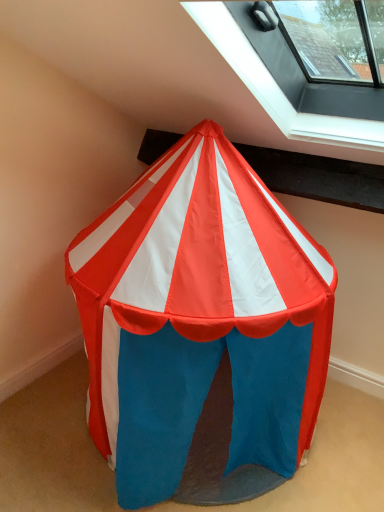
This screenshot has width=384, height=512. Describe the element at coordinates (277, 86) in the screenshot. I see `transparent glass window at upper right` at that location.

At what (x,y) coordinates should I click in order to perform the action: click on transparent glass window at upper right. Please return your answer as a coordinate pair (x, y). Image resolution: width=384 pixels, height=512 pixels. Looking at the image, I should click on (277, 86).

In order to face transparent glass window at upper right, should I rotate leftwards or rightwards?

You should rotate right by 18.417 degrees.

Locate an element on the screen. transparent glass window at upper right is located at coordinates (277, 86).